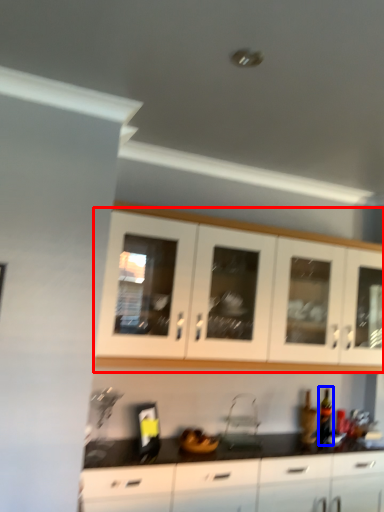
Question: Which object appears closest to the camera in this image, cabinetry (highlighted by a red box) or bottle (highlighted by a blue box)?

Choices:
 (A) cabinetry
 (B) bottle

Answer: (A)